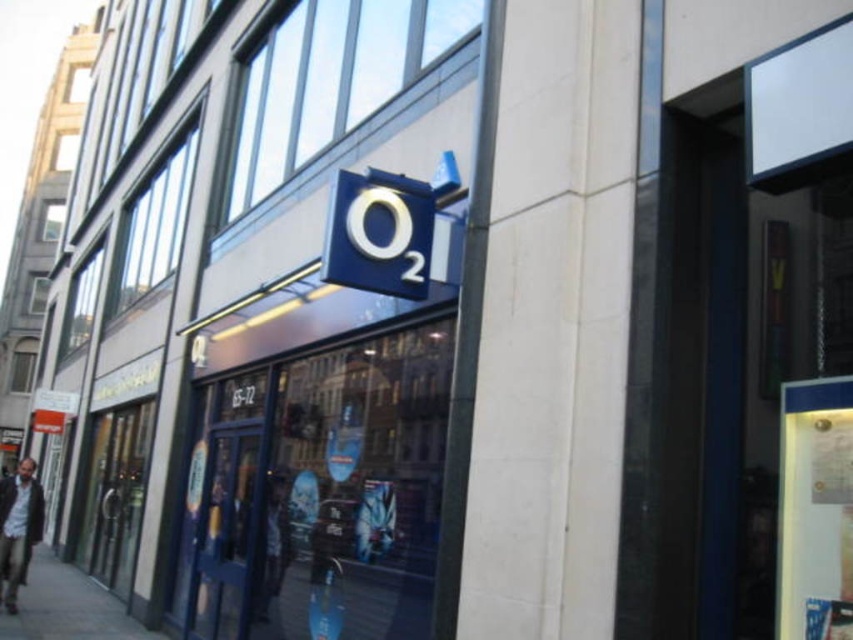
Between dark brown leather jacket at lower left and dark blue fabric jacket at center, which one is positioned higher?

Positioned higher is dark blue fabric jacket at center.

Can you confirm if dark brown leather jacket at lower left is bigger than dark blue fabric jacket at center?

Yes.

What do you see at coordinates (18, 529) in the screenshot?
I see `dark brown leather jacket at lower left` at bounding box center [18, 529].

The image size is (853, 640). In order to click on dark brown leather jacket at lower left in this screenshot , I will do click(18, 529).

Is concrete sidewalk at lower left bigger than dark blue fabric jacket at center?

Correct, concrete sidewalk at lower left is larger in size than dark blue fabric jacket at center.

Can you confirm if concrete sidewalk at lower left is smaller than dark blue fabric jacket at center?

Incorrect, concrete sidewalk at lower left is not smaller in size than dark blue fabric jacket at center.

Identify the location of concrete sidewalk at lower left. [x=67, y=605].

Where is `concrete sidewalk at lower left`? concrete sidewalk at lower left is located at coordinates (67, 605).

Is concrete sidewalk at lower left taller than dark brown leather jacket at lower left?

No, concrete sidewalk at lower left is not taller than dark brown leather jacket at lower left.

Consider the image. Is concrete sidewalk at lower left wider than dark brown leather jacket at lower left?

Correct, the width of concrete sidewalk at lower left exceeds that of dark brown leather jacket at lower left.

Describe the element at coordinates (67, 605) in the screenshot. I see `concrete sidewalk at lower left` at that location.

I want to click on concrete sidewalk at lower left, so click(67, 605).